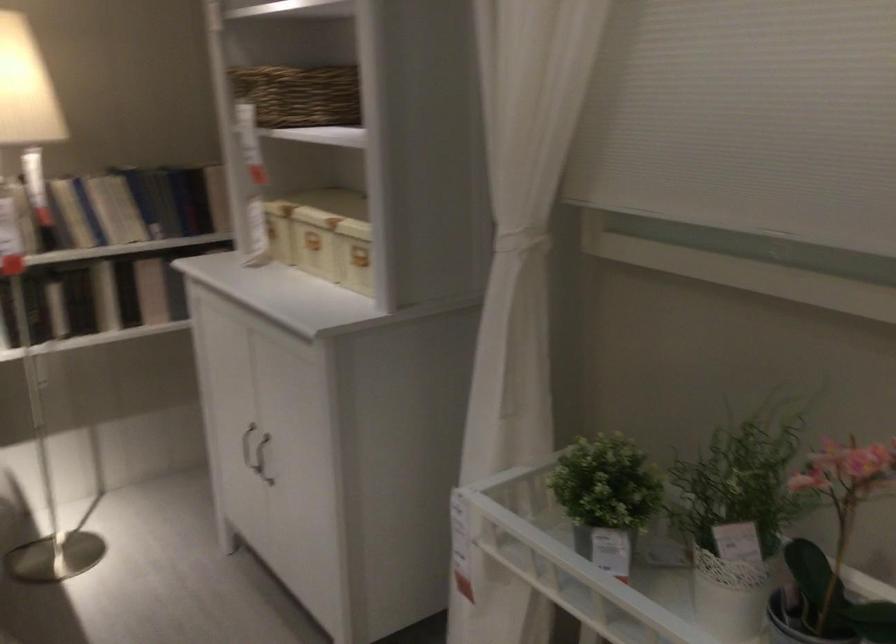
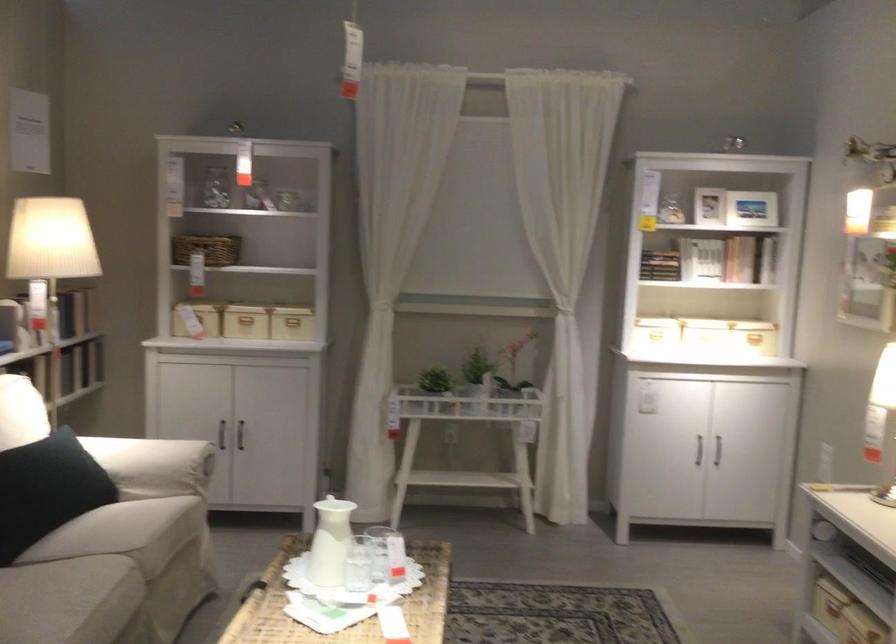
Locate, in the second image, the point that corresponds to [259,453] in the first image.

(240, 435)